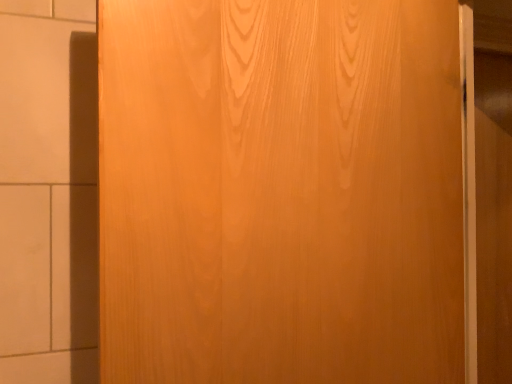
Question: Relative to wooden door at center, is wooden barn door at right in front or behind?

Choices:
 (A) front
 (B) behind

Answer: (B)

Question: Considering the positions of wooden barn door at right and wooden door at center in the image, is wooden barn door at right wider or thinner than wooden door at center?

Choices:
 (A) thin
 (B) wide

Answer: (A)

Question: Considering the positions of wooden barn door at right and wooden door at center in the image, is wooden barn door at right taller or shorter than wooden door at center?

Choices:
 (A) short
 (B) tall

Answer: (B)

Question: Considering the positions of wooden door at center and wooden barn door at right in the image, is wooden door at center wider or thinner than wooden barn door at right?

Choices:
 (A) thin
 (B) wide

Answer: (B)

Question: Visually, is wooden door at center positioned to the left or to the right of wooden barn door at right?

Choices:
 (A) right
 (B) left

Answer: (B)

Question: In terms of height, does wooden door at center look taller or shorter compared to wooden barn door at right?

Choices:
 (A) short
 (B) tall

Answer: (A)

Question: Is wooden door at center situated inside wooden barn door at right or outside?

Choices:
 (A) inside
 (B) outside

Answer: (B)